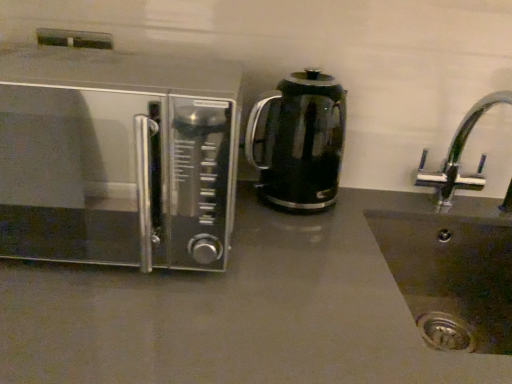
Where is `empty space that is ontop of satin silver microwave at left (from a real-world perspective)`? empty space that is ontop of satin silver microwave at left (from a real-world perspective) is located at coordinates (94, 70).